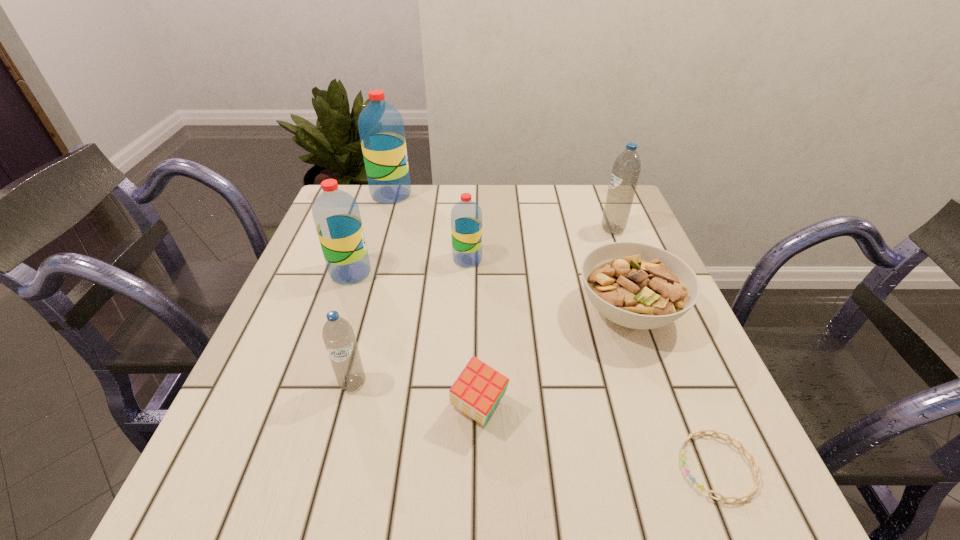
I want to click on free spot that satisfies the following two spatial constraints: 1. on the front label of the biggest red water bottle; 2. on the left side of the farther blue water bottle, so click(381, 230).